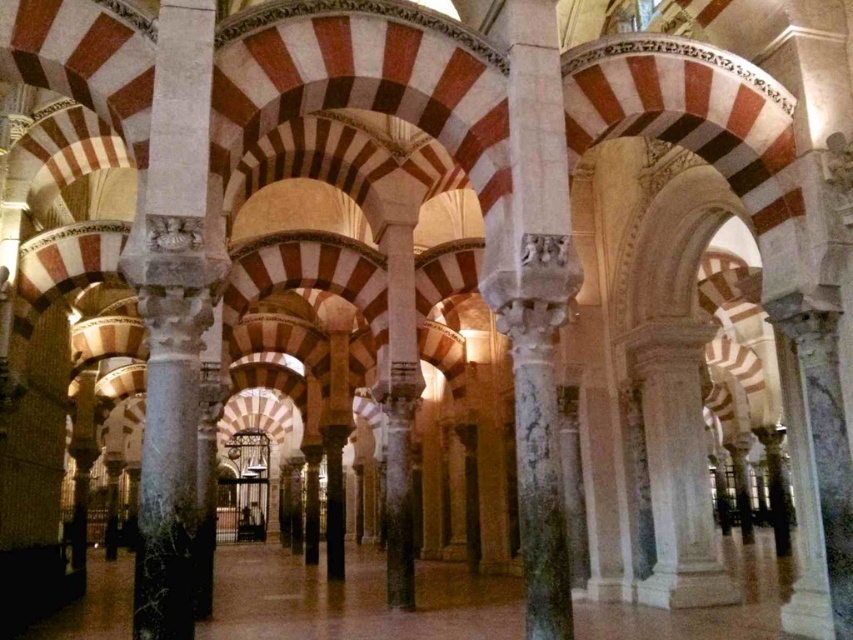
You are standing at the entrance of the grand architectural space and see the marble column at left. If you want to take a photo of it with your camera, which is 42.09 meters away from the column, will you be able to capture the entire column in the frame without moving closer?

The marble column at left and camera are 42.09 meters apart. Since the distance matches the camera position, you can capture the entire column in the frame without moving closer.

You are an architect designing a new exhibit that requires placing a 20 meter long sculpture between the marble column at left and the marble column at center. Based on the scene description, will the space between these two columns accommodate the sculpture?

The marble column at left and marble column at center are 21.72 meters apart, so the 20 meter long sculpture will fit between them since the distance is greater than the sculpture length.

You are an architect assessing the structural integrity of the columns in this grand space. Given that the marble column at left and the marble column at center are critical load bearers, which column might require additional reinforcement based on their height?

The marble column at left is not as tall as marble column at center, so it might require additional reinforcement since shorter columns can sometimes bear less load or may be more prone to instability depending on their design and material distribution.